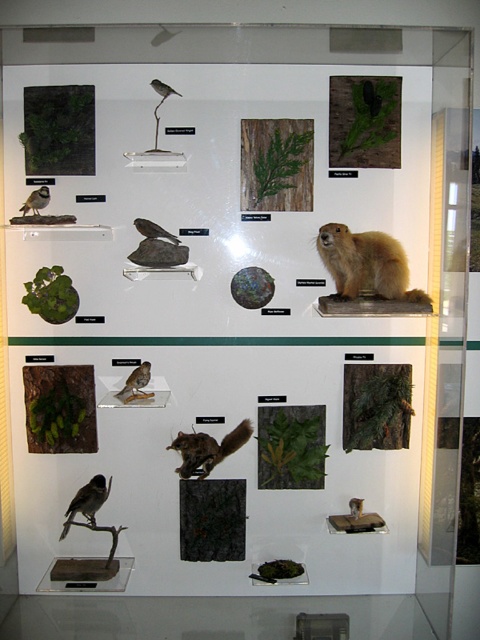
Is brown furry squirrel at center smaller than matte brown bird at left?

No.

Does point (369, 273) lie in front of point (38, 204)?

No, (369, 273) is further to viewer.

Between point (379, 230) and point (24, 209), which one is positioned behind?

The point (379, 230) is more distant.

The image size is (480, 640). In order to click on brown furry squirrel at center in this screenshot , I will do `click(365, 264)`.

Which is more to the left, brown feathered bird at center or brown matte bird at center?

From the viewer's perspective, brown matte bird at center appears more on the left side.

Between point (179, 472) and point (131, 387), which one is positioned behind?

The point (179, 472) is behind.

Who is more distant from viewer, (201, 445) or (132, 376)?

The point (201, 445) is behind.

Where is `brown feathered bird at center`? This screenshot has height=640, width=480. brown feathered bird at center is located at coordinates pos(207,449).

Is brown matte bird at center below matte brown bird at left?

Yes.

Which is more to the left, brown matte bird at center or matte brown bird at left?

matte brown bird at left is more to the left.

Locate an element on the screen. This screenshot has height=640, width=480. brown matte bird at center is located at coordinates (136, 384).

The width and height of the screenshot is (480, 640). Find the location of `brown matte bird at center`. brown matte bird at center is located at coordinates (136, 384).